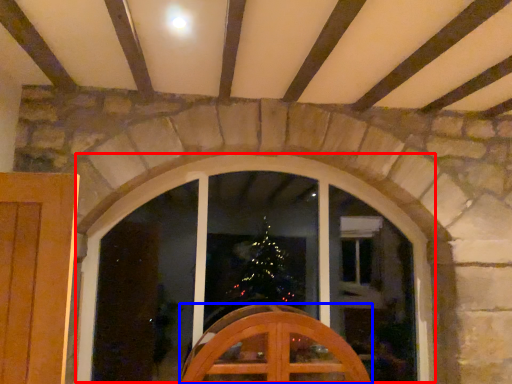
Question: Among these objects, which one is farthest to the camera, window (highlighted by a red box) or furniture (highlighted by a blue box)?

Choices:
 (A) window
 (B) furniture

Answer: (A)